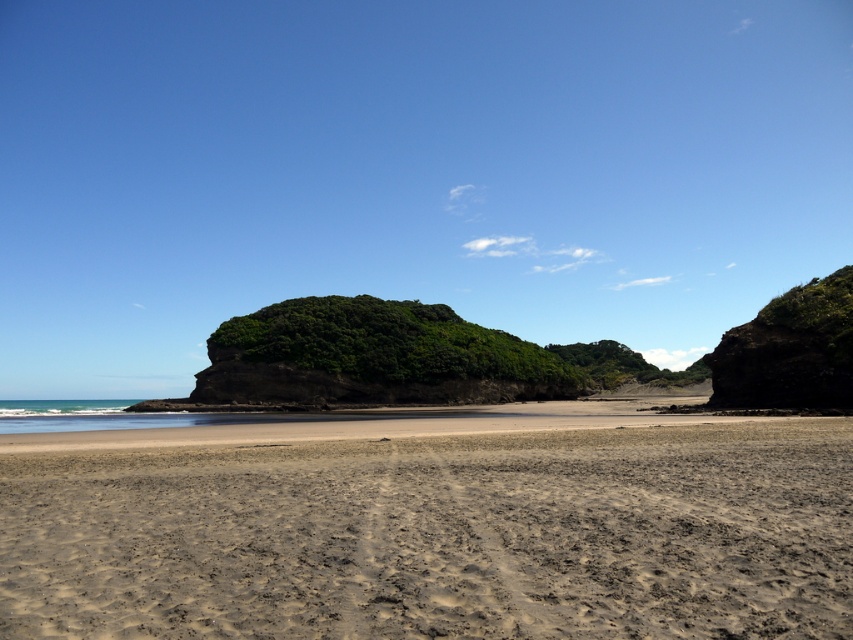
Between brown sandy beach at center and dark brown rocky cliff at right, which one has more height?

Standing taller between the two is dark brown rocky cliff at right.

Who is more forward, (x=178, y=499) or (x=784, y=298)?

Point (x=178, y=499) is in front.

You are a GUI agent. You are given a task and a screenshot of the screen. Output one action in this format:
    pyautogui.click(x=<x>, y=<y>)
    Task: Click on the brown sandy beach at center
    Image resolution: width=853 pixels, height=640 pixels.
    Given the screenshot: What is the action you would take?
    pyautogui.click(x=439, y=536)